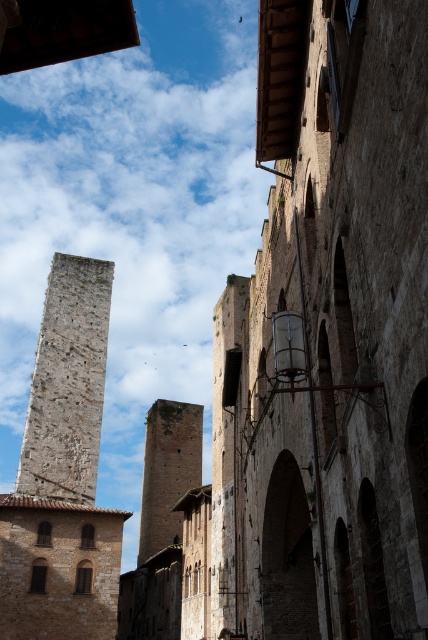
You are an architect analyzing the historic European town scene. You need to determine which tower is wider between the rough stone tower at left and the brown stone tower at center. Which one is wider?

The brown stone tower at center is wider than the rough stone tower at left.

In the historic European town scene, there are two towers visible. The rough stone tower at left and the brown stone tower at center. Which tower is positioned to the left of the other?

The rough stone tower at left is positioned to the left of the brown stone tower at center.